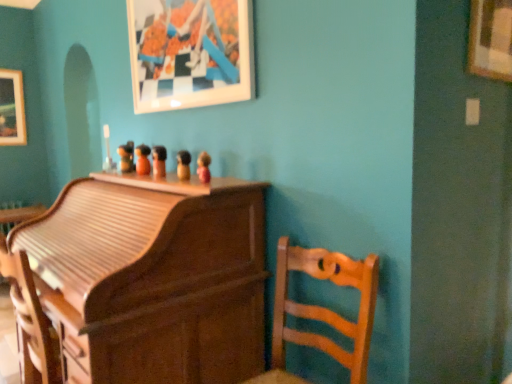
Question: Visually, is wooden roll-top desk at center, acting as the 1th furniture starting from the left, positioned to the left or to the right of wooden figurine at center, the 2th toy from the front?

Choices:
 (A) right
 (B) left

Answer: (B)

Question: Which is correct: wooden roll-top desk at center, which is the second furniture in right-to-left order, is inside wooden figurine at center, placed as the fourth toy when sorted from back to front, or outside of it?

Choices:
 (A) inside
 (B) outside

Answer: (B)

Question: Which object is positioned closest to the matte wooden figurine at center, which is the 5th toy in back-to-front order?

Choices:
 (A) wooden toy at center, the 4th toy from the front
 (B) wooden picture frame at upper right, placed as the 1th picture frame when sorted from front to back
 (C) wooden chair at center, which is the 2th furniture in left-to-right order
 (D) wooden roll-top desk at center, which is the second furniture in right-to-left order
 (E) matte white picture frame at upper center, the second picture frame positioned from the front

Answer: (A)

Question: Which object is the farthest from the wooden figurine at center, the third toy when ordered from right to left?

Choices:
 (A) wooden picture frame at upper right, the 1th picture frame from the right
 (B) matte white picture frame at upper center, the second picture frame viewed from the right
 (C) wooden roll-top desk at center, which is the second furniture in right-to-left order
 (D) wooden chair at center, which is the 2th furniture in left-to-right order
 (E) wooden toy at center, the 4th toy positioned from the right

Answer: (A)